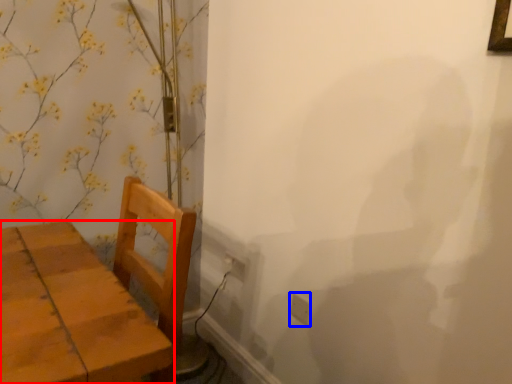
Question: Among these objects, which one is nearest to the camera, furniture (highlighted by a red box) or electric outlet (highlighted by a blue box)?

Choices:
 (A) furniture
 (B) electric outlet

Answer: (A)